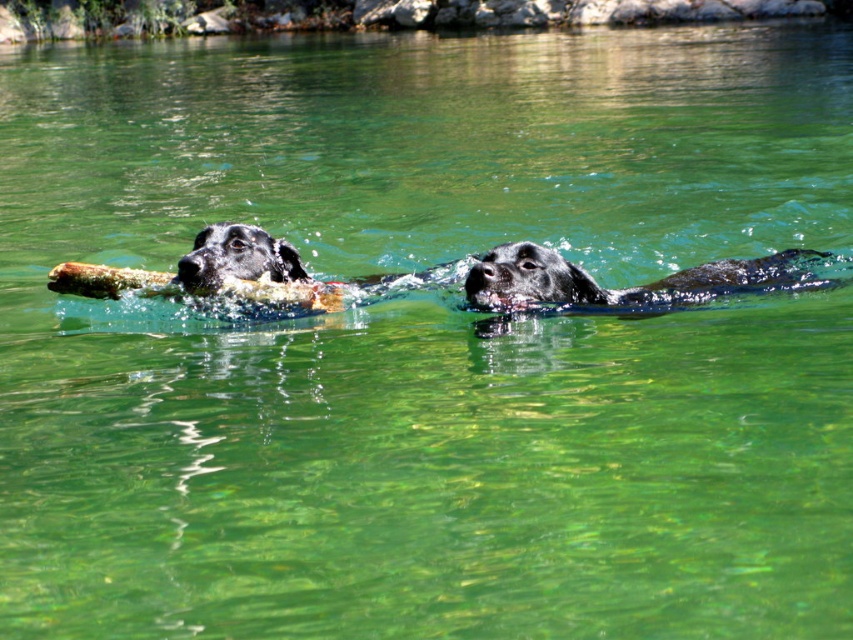
Question: Is shiny black fur at center above black glossy dog at left?

Choices:
 (A) no
 (B) yes

Answer: (A)

Question: Is shiny black fur at center in front of black glossy dog at left?

Choices:
 (A) no
 (B) yes

Answer: (B)

Question: Which of the following is the farthest from the observer?

Choices:
 (A) shiny black fur at center
 (B) black glossy dog at left

Answer: (B)

Question: Which of the following is the farthest from the observer?

Choices:
 (A) (544, 292)
 (B) (248, 237)

Answer: (B)

Question: Can you confirm if shiny black fur at center is positioned below black glossy dog at left?

Choices:
 (A) yes
 (B) no

Answer: (A)